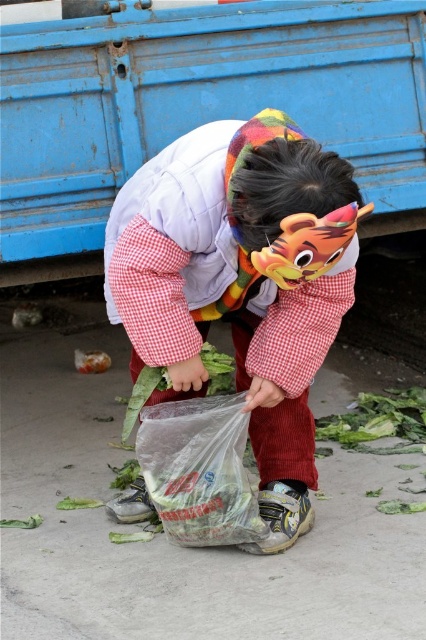
You are a photographer trying to capture a closeup of the white corduroy pants at center. Given that your camera can focus on objects within 2 meters, will you be able to take the closeup without moving closer?

The white corduroy pants at center is 2.15 meters from the camera, which is beyond the 2 meter focus range. Therefore, you cannot take the closeup without moving closer.

You are a photographer trying to capture the child in the scene. Since you want to focus on the white corduroy pants at center and the transparent plastic bag at center, which object should you adjust your camera angle to ensure both are in frame without cropping?

Since the white corduroy pants at center has a greater height compared to the transparent plastic bag at center, you should adjust your camera angle to look slightly upward to include the full height of the white corduroy pants at center while still keeping the transparent plastic bag at center in view.